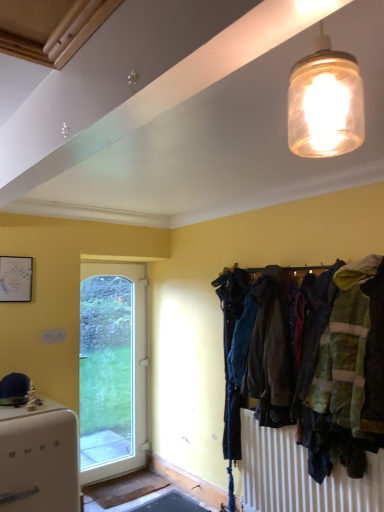
Where is `free spot above white matte refrigerator at lower left (from a real-world perspective)`? This screenshot has width=384, height=512. free spot above white matte refrigerator at lower left (from a real-world perspective) is located at coordinates (29, 413).